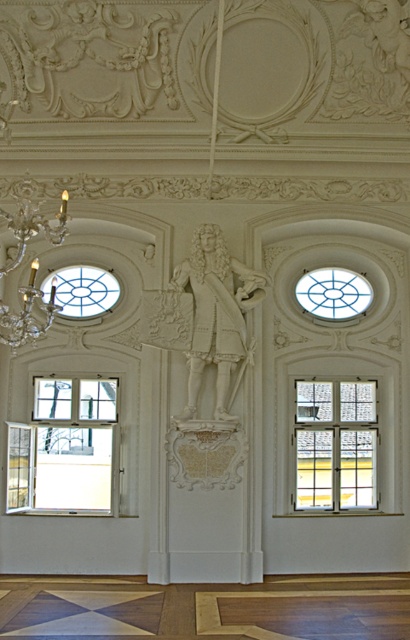
You are standing in the opulent interior space with the statue and the ornate ceiling. You notice a point marked at coordinates (63, 449). What object is located at this position?

The point at (63, 449) marks the clear glass window at lower left.